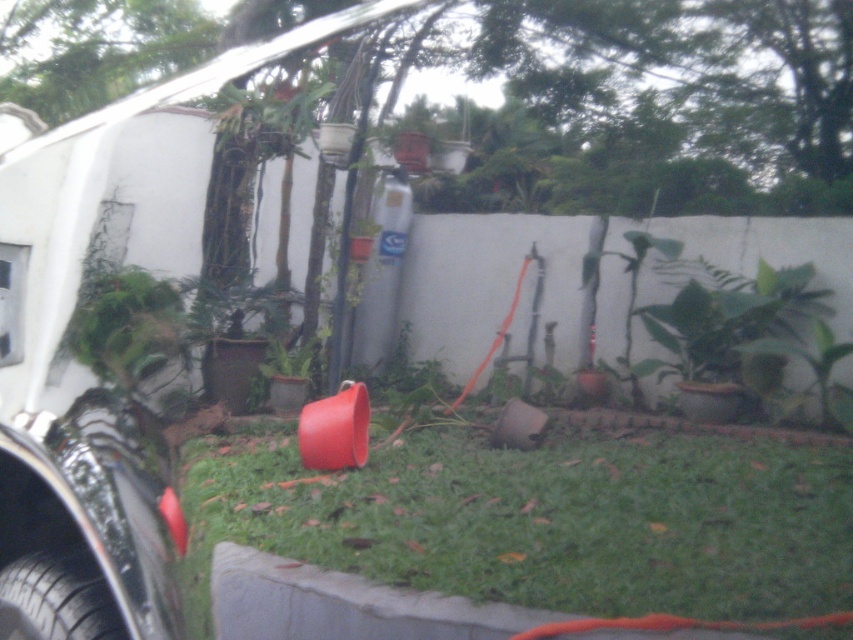
You are trying to decide where to place a small garden gnome that is 1 foot tall. The gnome needs to stand on a surface that is both stable and large enough to accommodate its base. Based on the image, which object from the list below would be the best choice? Choose between the green grass at center and the black rubber tire at lower left.

The green grass at center is bigger than the black rubber tire at lower left, so the green grass at center would provide a more stable and spacious base for the gnome.

From the picture: You are trying to move the black rubber tire at lower left out of the way. Can you move it without moving the gray concrete curb at lower left first?

The black rubber tire at lower left is behind the gray concrete curb at lower left, so you can move the black rubber tire at lower left without moving the gray concrete curb at lower left first.